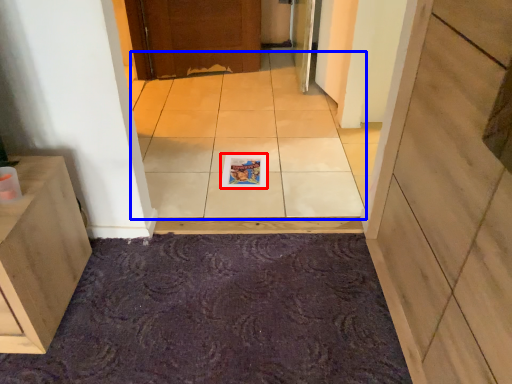
Question: Which of the following is the farthest to the observer, magazine (highlighted by a red box) or ceramic tile (highlighted by a blue box)?

Choices:
 (A) magazine
 (B) ceramic tile

Answer: (A)